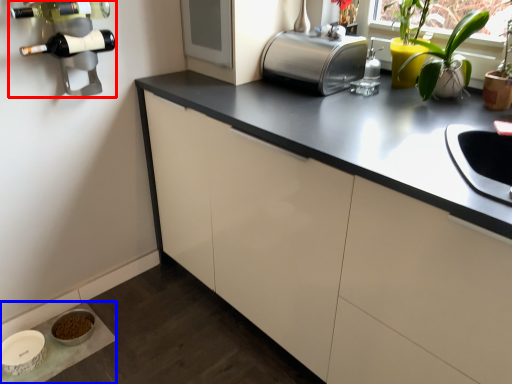
Question: Which of the following is the farthest to the observer, wine rack (highlighted by a red box) or table (highlighted by a blue box)?

Choices:
 (A) wine rack
 (B) table

Answer: (B)